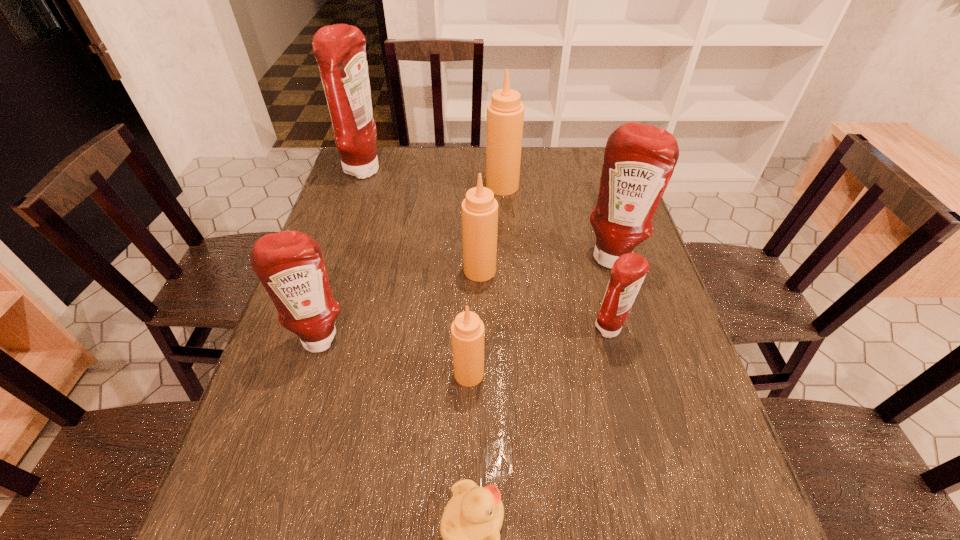
In order to click on the tallest condiment in this screenshot , I will do `click(340, 49)`.

Where is `the farthest red condiment`? The width and height of the screenshot is (960, 540). the farthest red condiment is located at coordinates (340, 49).

Locate an element on the screen. the biggest tan condiment is located at coordinates (505, 113).

Locate an element on the screen. Image resolution: width=960 pixels, height=540 pixels. the third nearest red condiment is located at coordinates pyautogui.click(x=639, y=160).

This screenshot has height=540, width=960. What are the coordinates of `the second smallest tan condiment` in the screenshot? It's located at (479, 209).

Where is `the third biggest red condiment`? Image resolution: width=960 pixels, height=540 pixels. the third biggest red condiment is located at coordinates (290, 265).

You are a GUI agent. You are given a task and a screenshot of the screen. Output one action in this format:
    pyautogui.click(x=<x>, y=<y>)
    Task: Click on the smallest red condiment
    The height and width of the screenshot is (540, 960).
    Given the screenshot: What is the action you would take?
    pyautogui.click(x=628, y=272)

Find the location of a particular element. The image size is (960, 540). the nearest condiment is located at coordinates (467, 330).

Locate an element on the screen. The width and height of the screenshot is (960, 540). the smallest tan condiment is located at coordinates (467, 330).

In order to click on vacant area located on the front of the tallest condiment in this screenshot , I will do `click(330, 274)`.